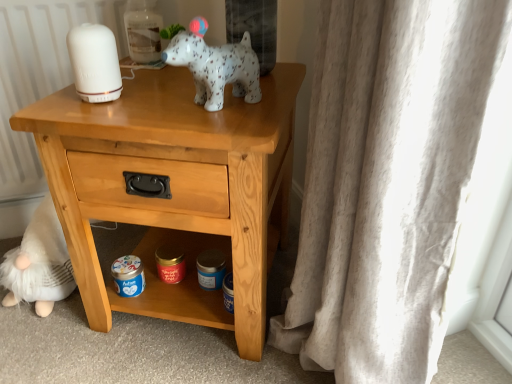
Image resolution: width=512 pixels, height=384 pixels. In order to click on free space on the front side of white fluffy gnome at lower left in this screenshot , I will do `click(42, 343)`.